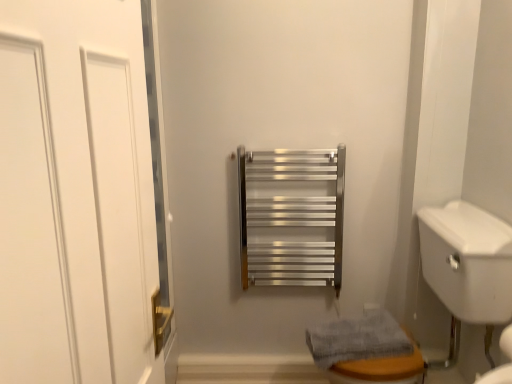
Question: Relative to gray textured towel at lower right, is white matte door at left in front or behind?

Choices:
 (A) behind
 (B) front

Answer: (B)

Question: Is white matte door at left inside or outside of gray textured towel at lower right?

Choices:
 (A) outside
 (B) inside

Answer: (A)

Question: Which object is positioned closest to the gray textured towel at lower right?

Choices:
 (A) white matte door at left
 (B) white glossy sink at lower right

Answer: (B)

Question: Estimate the real-world distances between objects in this image. Which object is closer to the gray textured towel at lower right?

Choices:
 (A) white matte door at left
 (B) white glossy sink at lower right

Answer: (B)